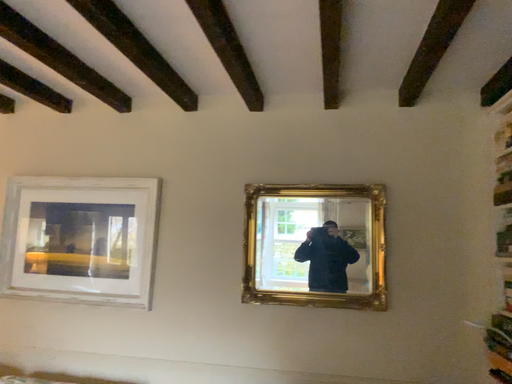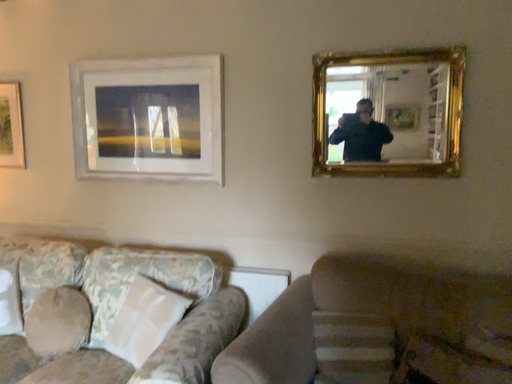
Question: Which way did the camera rotate in the video?

Choices:
 (A) rotated upward
 (B) rotated downward

Answer: (B)